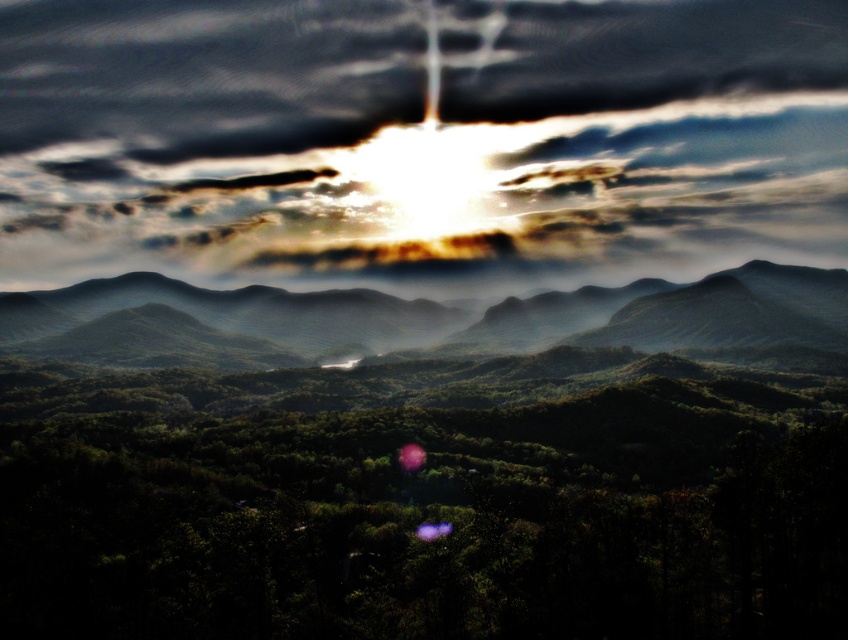
The width and height of the screenshot is (848, 640). I want to click on cloudy sky at upper center, so click(x=419, y=141).

Looking at this image, can you confirm if cloudy sky at upper center is taller than smooth green mountains at center?

Indeed, cloudy sky at upper center has a greater height compared to smooth green mountains at center.

You are a GUI agent. You are given a task and a screenshot of the screen. Output one action in this format:
    pyautogui.click(x=<x>, y=<y>)
    Task: Click on the cloudy sky at upper center
    
    Given the screenshot: What is the action you would take?
    pyautogui.click(x=419, y=141)